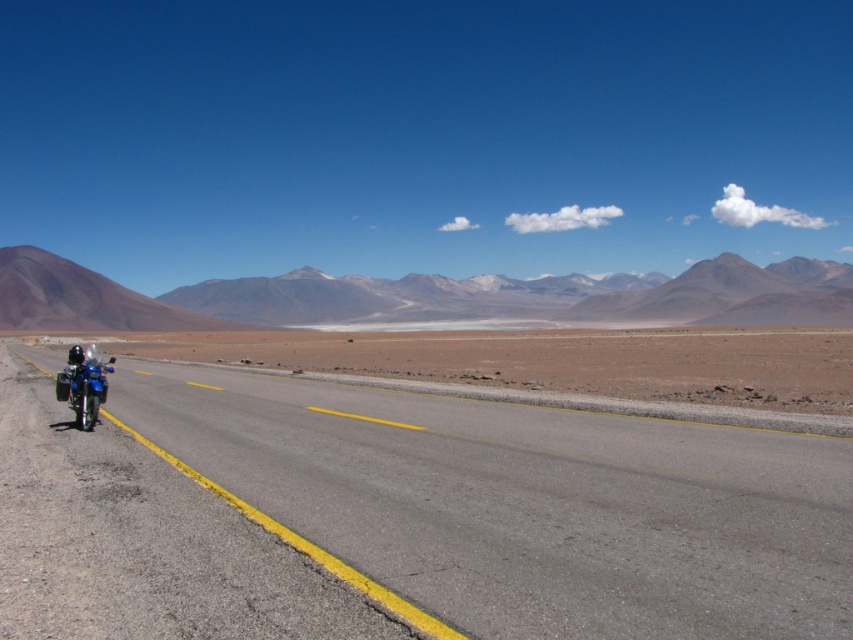
Consider the image. Who is taller, rustic brown mountain at left or blue metallic motorbike at left?

rustic brown mountain at left

This screenshot has height=640, width=853. Find the location of `rustic brown mountain at left`. rustic brown mountain at left is located at coordinates (83, 298).

The height and width of the screenshot is (640, 853). What do you see at coordinates (83, 298) in the screenshot? I see `rustic brown mountain at left` at bounding box center [83, 298].

The image size is (853, 640). In order to click on rustic brown mountain at left in this screenshot , I will do [x=83, y=298].

Is smooth asphalt road at center closer to the viewer compared to rustic brown mountain at left?

Yes, it is.

I want to click on smooth asphalt road at center, so click(x=527, y=504).

At what (x,y) coordinates should I click in order to perform the action: click on smooth asphalt road at center. Please return your answer as a coordinate pair (x, y). Looking at the image, I should click on (527, 504).

Between point (381, 509) and point (93, 403), which one is positioned behind?

The point (93, 403) is behind.

Does point (471, 595) come farther from viewer compared to point (88, 417)?

No, it is in front of (88, 417).

Locate an element on the screen. This screenshot has height=640, width=853. smooth asphalt road at center is located at coordinates (527, 504).